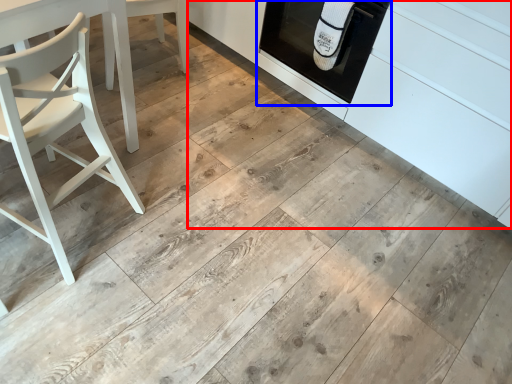
Question: Which of the following is the closest to the observer, cabinetry (highlighted by a red box) or oven (highlighted by a blue box)?

Choices:
 (A) cabinetry
 (B) oven

Answer: (A)